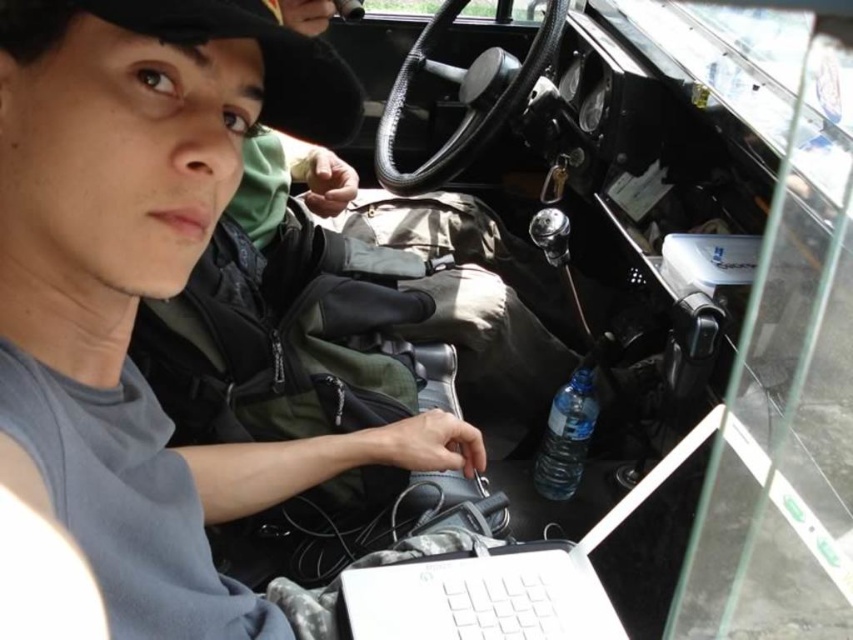
You are a passenger in the vehicle and need to reach for either the white plastic laptop at center or the clear plastic bottle at lower right. Which object is easier to reach without moving your seat forward?

The white plastic laptop at center is closer to the viewer than the clear plastic bottle at lower right, so it would be easier to reach without moving your seat forward.

You are a passenger in the vehicle and need to place your phone on the dashboard. The dashboard has a rectangular surface. The white plastic laptop at center is currently occupying some space. Based on its position coordinates, can you estimate whether there is enough space left on the dashboard to place a phone of standard size?

The white plastic laptop at center is positioned at coordinates (505, 580). Since the dashboard has a rectangular surface and the laptop is placed towards the lower right area, there should be sufficient space remaining on the dashboard to accommodate a standard sized phone.